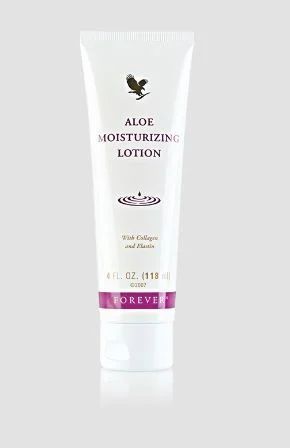
Where is `lotion bottle`? The width and height of the screenshot is (290, 448). lotion bottle is located at coordinates (166, 175).